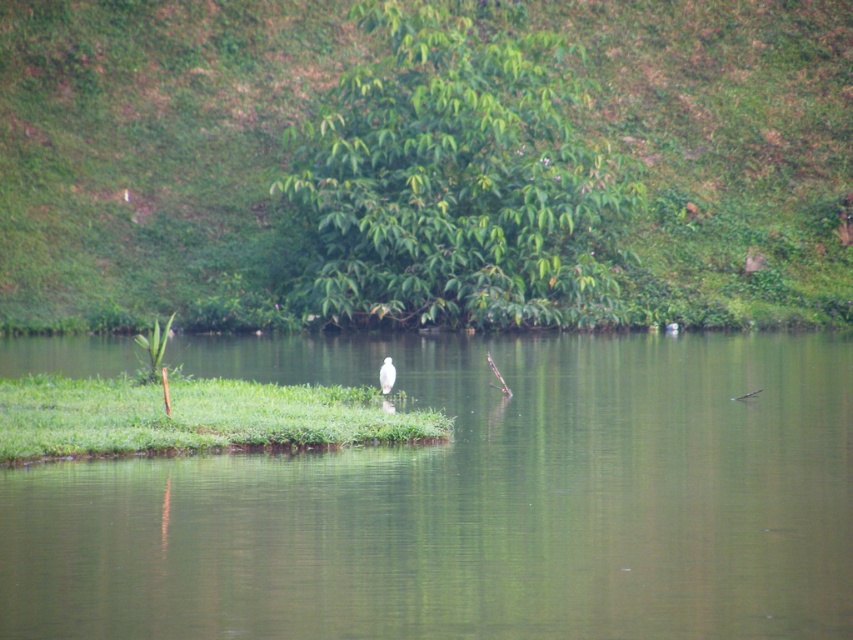
You are a hiker trying to find the best path to the water. You see the green leafy hillside at center and the green grass at center. Which direction should you walk to reach the water first?

The green grass at center is on the left side of the green leafy hillside at center, so you should walk towards the left to reach the water first.

You are a photographer trying to capture the entire scene in one shot. You notice the green smooth water at center and the green leafy tree at upper center. Which object appears wider in the image?

The green smooth water at center appears wider than the green leafy tree at upper center because its width surpasses the tree.

You are standing at the edge of the water and want to reach the green leafy hillside at center. Which direction should you head to from your current position?

The green leafy hillside at center is located at point (424, 163), so you should head towards the center of the image to reach it.